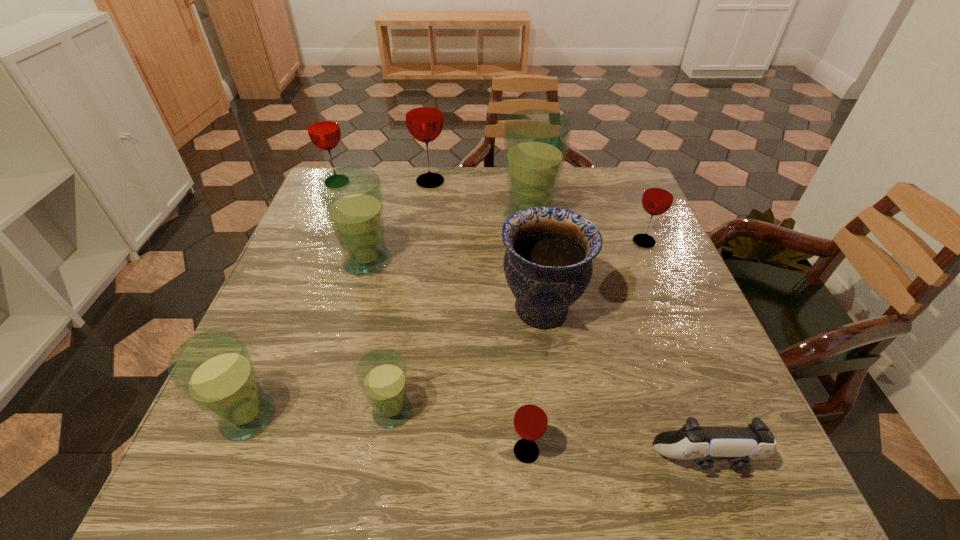
Locate an element on the screen. Image resolution: width=960 pixels, height=540 pixels. the biggest red glass is located at coordinates (424, 117).

Identify the location of the biggest blue glass. (536, 141).

This screenshot has width=960, height=540. I want to click on the rightmost blue glass, so click(536, 141).

This screenshot has height=540, width=960. Identify the location of the second biggest red glass. (323, 128).

Locate an element on the screen. This screenshot has height=540, width=960. the third glass from left to right is located at coordinates (352, 197).

The height and width of the screenshot is (540, 960). Find the location of `the third blue glass from right to left`. the third blue glass from right to left is located at coordinates (352, 197).

Where is `pottery`? The height and width of the screenshot is (540, 960). pottery is located at coordinates (548, 265).

Image resolution: width=960 pixels, height=540 pixels. I want to click on the rightmost red glass, so click(x=658, y=196).

Locate an element on the screen. The image size is (960, 540). the third farthest red glass is located at coordinates (658, 196).

The image size is (960, 540). I want to click on the second smallest blue glass, so click(214, 369).